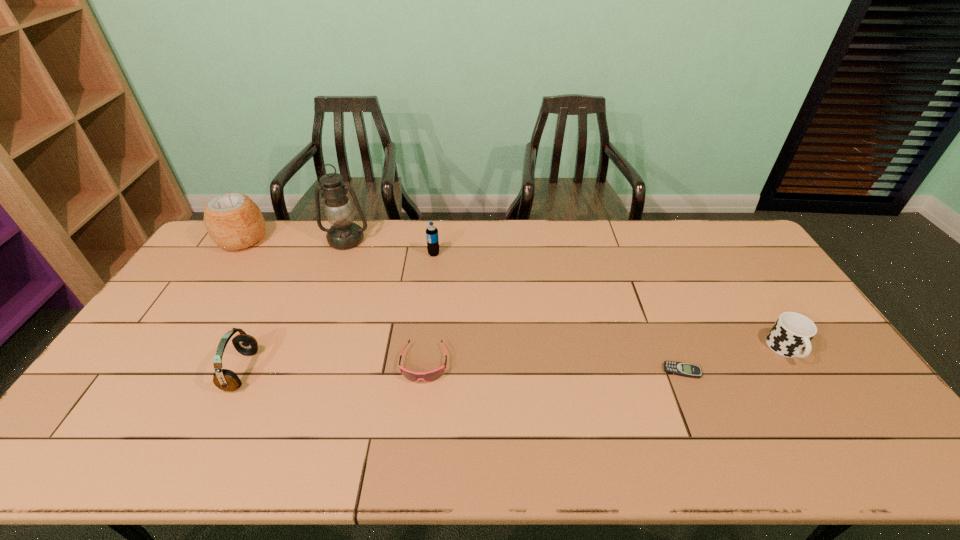
What are the coordinates of `soda bottle situated at the far edge` in the screenshot? It's located at (432, 238).

Where is `object that is at the left edge`? The height and width of the screenshot is (540, 960). object that is at the left edge is located at coordinates (233, 221).

Image resolution: width=960 pixels, height=540 pixels. What are the coordinates of `object located in the right edge section of the desktop` in the screenshot? It's located at (791, 334).

At what (x,y) coordinates should I click in order to perform the action: click on object located at the far left corner. Please return your answer as a coordinate pair (x, y). The width and height of the screenshot is (960, 540). Looking at the image, I should click on (233, 221).

Identify the location of free location at the far edge. Image resolution: width=960 pixels, height=540 pixels. (x=451, y=225).

Locate an element on the screen. Image resolution: width=960 pixels, height=540 pixels. vacant space at the near edge is located at coordinates coord(283,433).

You are a GUI agent. You are given a task and a screenshot of the screen. Output one action in this format:
    pyautogui.click(x=<x>, y=<y>)
    Task: Click on the vacant space at the left edge of the desktop
    This screenshot has width=960, height=540.
    Given the screenshot: What is the action you would take?
    pyautogui.click(x=183, y=303)

At what (x,y) coordinates should I click in order to perform the action: click on vacant space at the far right corner of the desktop. Please return your answer as a coordinate pair (x, y). Looking at the image, I should click on (734, 232).

You are a GUI agent. You are given a task and a screenshot of the screen. Output one action in this format:
    pyautogui.click(x=<x>, y=<y>)
    Task: Click on the blank region between the tallest object and the cup
    The width and height of the screenshot is (960, 540).
    Given the screenshot: What is the action you would take?
    pyautogui.click(x=566, y=295)

The image size is (960, 540). Identify the location of free space between the coconut and the headset. (242, 305).